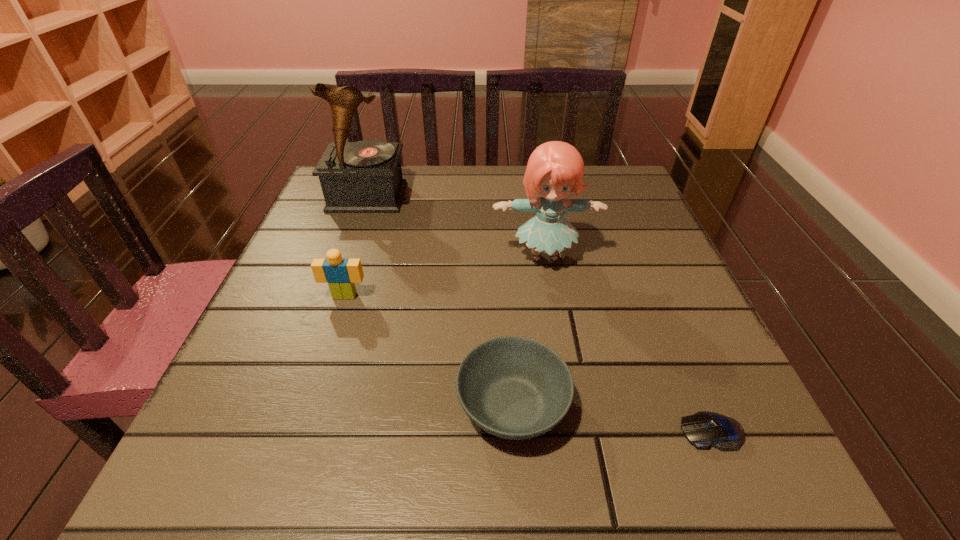
This screenshot has height=540, width=960. I want to click on the farthest object, so click(x=365, y=176).

The height and width of the screenshot is (540, 960). I want to click on the second farthest object, so click(x=555, y=168).

Locate an element on the screen. This screenshot has width=960, height=540. the fourth shortest object is located at coordinates (555, 168).

Identify the location of Lego. The image size is (960, 540). (341, 274).

At what (x,y) coordinates should I click in order to perform the action: click on the third tallest object. Please return your answer as a coordinate pair (x, y). The image size is (960, 540). Looking at the image, I should click on (341, 274).

Locate an element on the screen. the fourth tallest object is located at coordinates (513, 387).

Identify the location of computer mouse. The height and width of the screenshot is (540, 960). (703, 429).

Identify the location of the rightmost object. The height and width of the screenshot is (540, 960). point(703,429).

This screenshot has width=960, height=540. Find the location of `free space located at the horn opening of the farthest object`. free space located at the horn opening of the farthest object is located at coordinates (344, 264).

Locate an element on the screen. This screenshot has width=960, height=540. blank space located 0.050m on the front-facing side of the doll is located at coordinates 551,294.